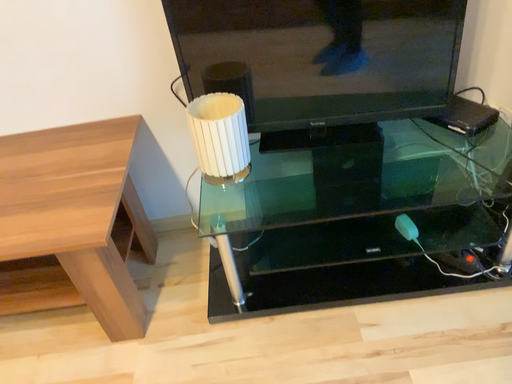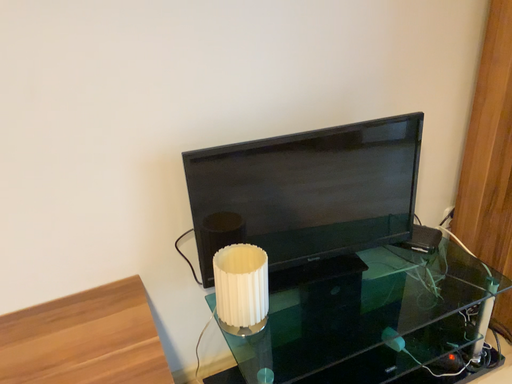
Question: How did the camera likely rotate when shooting the video?

Choices:
 (A) rotated right
 (B) rotated left

Answer: (A)